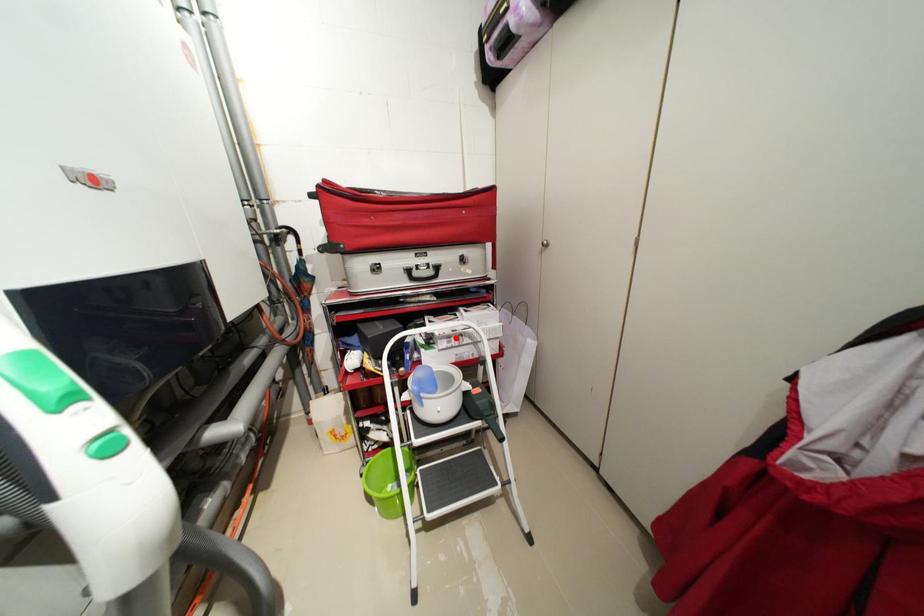
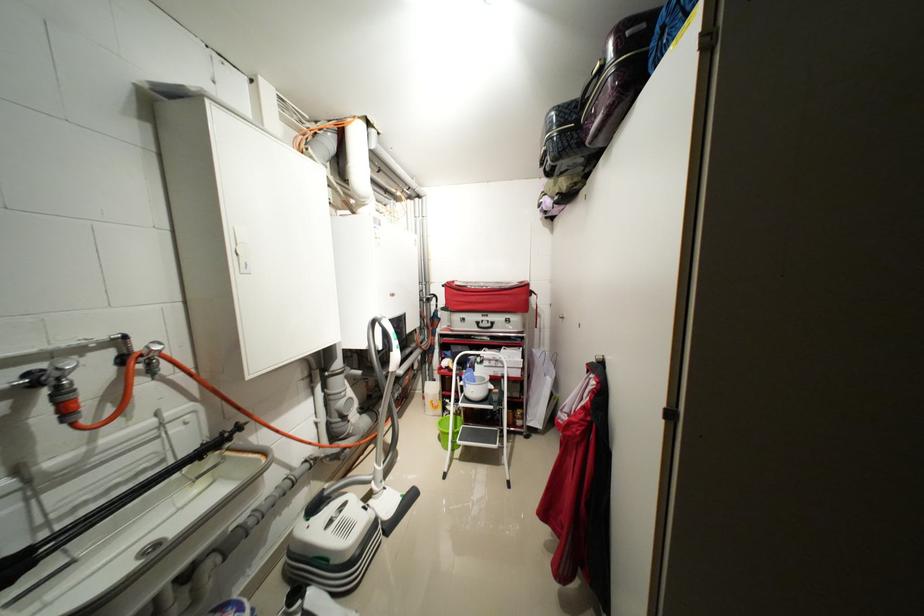
Where in the second image is the point corresponding to the highlighted location from the first image?

(496, 361)